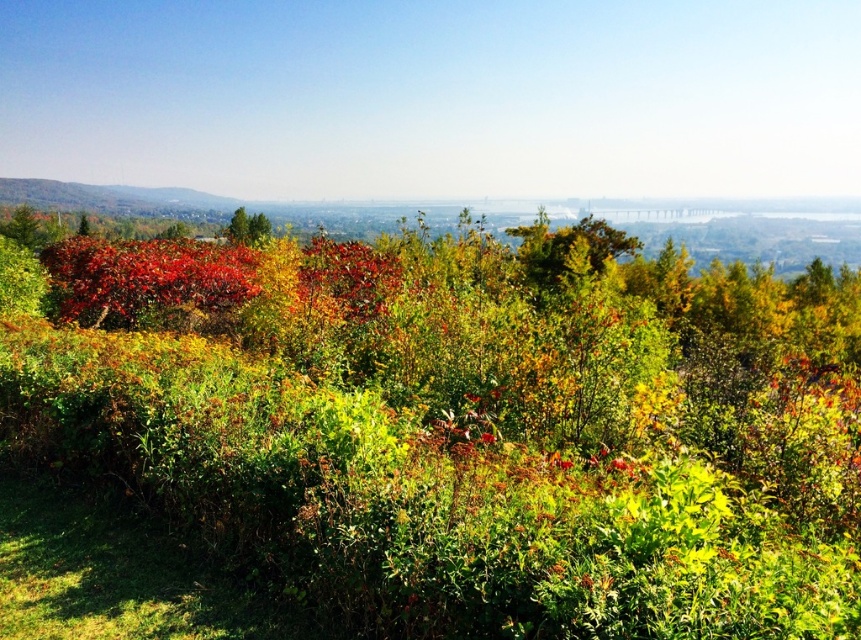
Between point (141, 310) and point (230, 221), which one is positioned behind?

Point (230, 221)

Does shiny red leaves at center appear under green matte tree at center?

Yes.

Describe the element at coordinates (146, 276) in the screenshot. The image size is (861, 640). I see `shiny red leaves at center` at that location.

At what (x,y) coordinates should I click in order to perform the action: click on shiny red leaves at center. Please return your answer as a coordinate pair (x, y). The height and width of the screenshot is (640, 861). Looking at the image, I should click on (146, 276).

Which of these two, green leafy bush at center or shiny red leaves at center, stands taller?

green leafy bush at center

Who is shorter, green leafy bush at center or shiny red leaves at center?

Standing shorter between the two is shiny red leaves at center.

Measure the distance between green leafy bush at center and camera.

They are 8.83 feet apart.

Find the location of a particular element. The image size is (861, 640). green leafy bush at center is located at coordinates (469, 429).

Who is positioned more to the right, green leafy tree at center or green matte tree at center?

Positioned to the right is green leafy tree at center.

Can you confirm if green leafy tree at center is bigger than green matte tree at center?

No, green leafy tree at center is not bigger than green matte tree at center.

The width and height of the screenshot is (861, 640). What do you see at coordinates (568, 250) in the screenshot?
I see `green leafy tree at center` at bounding box center [568, 250].

Locate an element on the screen. green leafy tree at center is located at coordinates (568, 250).